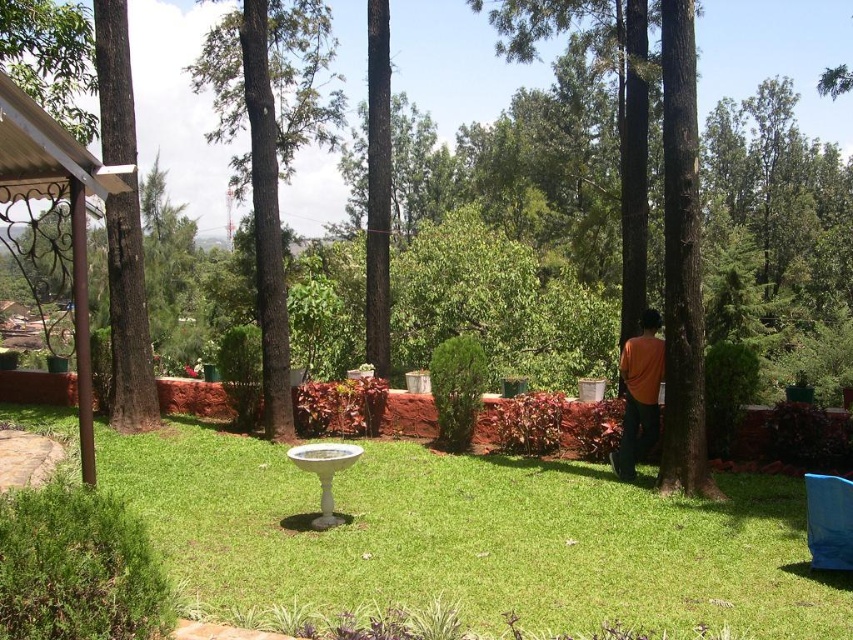
Which is below, green grass at center or brown wrought iron gazebo at left?

green grass at center

Who is more forward, (643, 593) or (49, 196)?

Point (643, 593) is in front.

Locate an element on the screen. Image resolution: width=853 pixels, height=640 pixels. green grass at center is located at coordinates (474, 538).

Does dark green bark tree at center have a smaller size compared to brown rough tree at left?

Incorrect, dark green bark tree at center is not smaller in size than brown rough tree at left.

You are a GUI agent. You are given a task and a screenshot of the screen. Output one action in this format:
    pyautogui.click(x=<x>, y=<y>)
    Task: Click on the dark green bark tree at center
    
    Given the screenshot: What is the action you would take?
    pyautogui.click(x=270, y=144)

Measure the distance between dark green bark tree at center and camera.

The distance of dark green bark tree at center from camera is 9.71 meters.

In order to click on dark green bark tree at center in this screenshot , I will do `click(270, 144)`.

Is point (514, 513) farther from camera compared to point (271, 97)?

That is False.

Can you confirm if green grass at center is taller than dark green bark tree at center?

Incorrect, green grass at center's height is not larger of dark green bark tree at center's.

I want to click on green grass at center, so click(x=474, y=538).